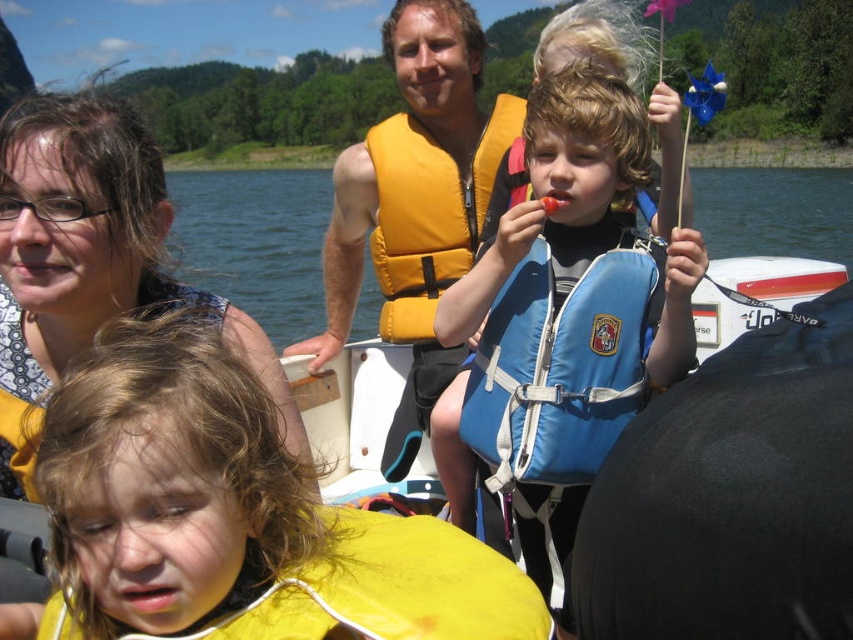
You are a photographer on the boat and want to capture both the blue fabric life jacket at center and the yellow fabric life jacket at center in a single shot. Based on their positions, which life jacket will appear closer to the bottom of the photo?

The blue fabric life jacket at center is located below the yellow fabric life jacket at center, so it will appear closer to the bottom of the photo.

You are a photographer trying to capture a photo of the matte black hair at upper left and the blue fabric life jacket at center. Based on their positions, which object would you need to focus on first if you are moving from the front of the boat to the back?

The matte black hair at upper left is located above the blue fabric life jacket at center, so you would need to focus on the blue fabric life jacket at center first as it is closer to the front of the boat.